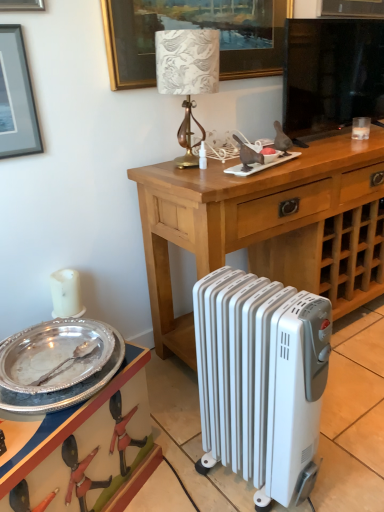
The image size is (384, 512). I want to click on vacant area that lies to the right of white metallic radiator at lower center, so click(349, 454).